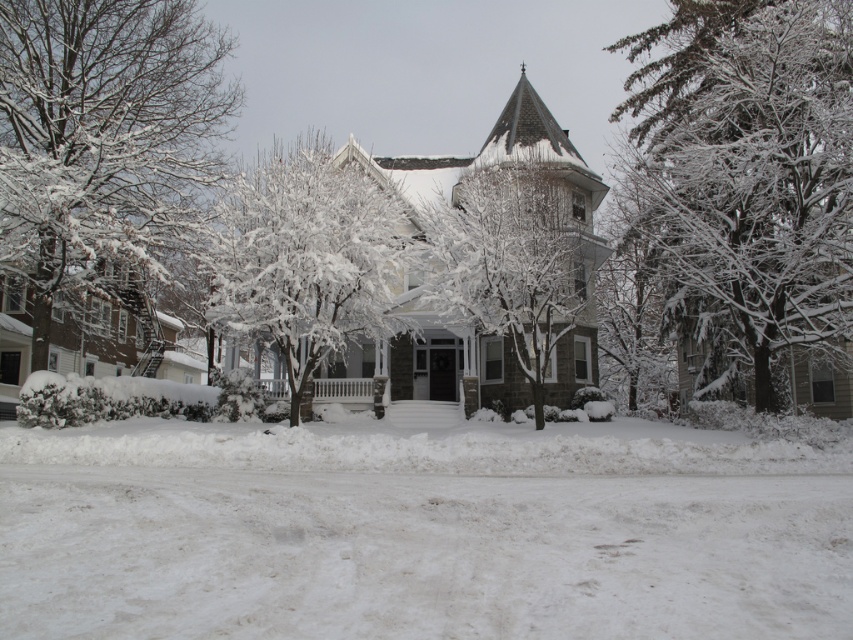
Question: Does white snow-covered tree at left have a larger size compared to white snow-covered tree at center?

Choices:
 (A) yes
 (B) no

Answer: (B)

Question: Considering the relative positions of white fluffy snow at center and snow-covered branches at center in the image provided, where is white fluffy snow at center located with respect to snow-covered branches at center?

Choices:
 (A) right
 (B) left

Answer: (B)

Question: Estimate the real-world distances between objects in this image. Which object is farther from the white snow-covered tree at left?

Choices:
 (A) snow-covered tree at center
 (B) white fluffy snow at center
 (C) white snow-covered tree at center

Answer: (A)

Question: Which of the following is the closest to the observer?

Choices:
 (A) (119, 36)
 (B) (683, 595)

Answer: (B)

Question: Which object appears farthest from the camera in this image?

Choices:
 (A) white fluffy snow at center
 (B) white snow-covered tree at left

Answer: (B)

Question: Does white fluffy snow at center have a larger size compared to snow-covered branches at center?

Choices:
 (A) yes
 (B) no

Answer: (B)